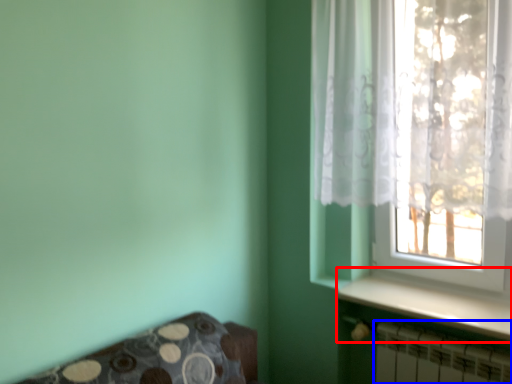
Question: Which of the following is the closest to the observer, window sill (highlighted by a red box) or radiator (highlighted by a blue box)?

Choices:
 (A) window sill
 (B) radiator

Answer: (B)